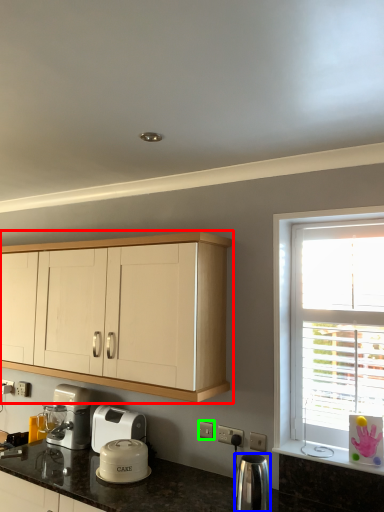
Question: Which is farther away from cabinetry (highlighted by a red box)? kitchen appliance (highlighted by a blue box) or electric outlet (highlighted by a green box)?

Choices:
 (A) kitchen appliance
 (B) electric outlet

Answer: (A)